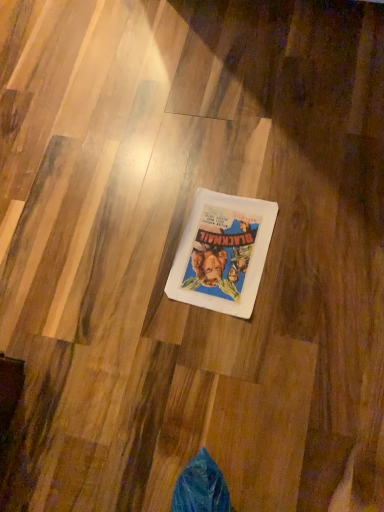
Locate an element on the screen. white matte book cover at center is located at coordinates (222, 253).

The width and height of the screenshot is (384, 512). What do you see at coordinates (222, 253) in the screenshot?
I see `white matte book cover at center` at bounding box center [222, 253].

You are a GUI agent. You are given a task and a screenshot of the screen. Output one action in this format:
    pyautogui.click(x=<x>, y=<y>)
    Task: Click on the white matte book cover at center
    The image size is (384, 512).
    Given the screenshot: What is the action you would take?
    pyautogui.click(x=222, y=253)